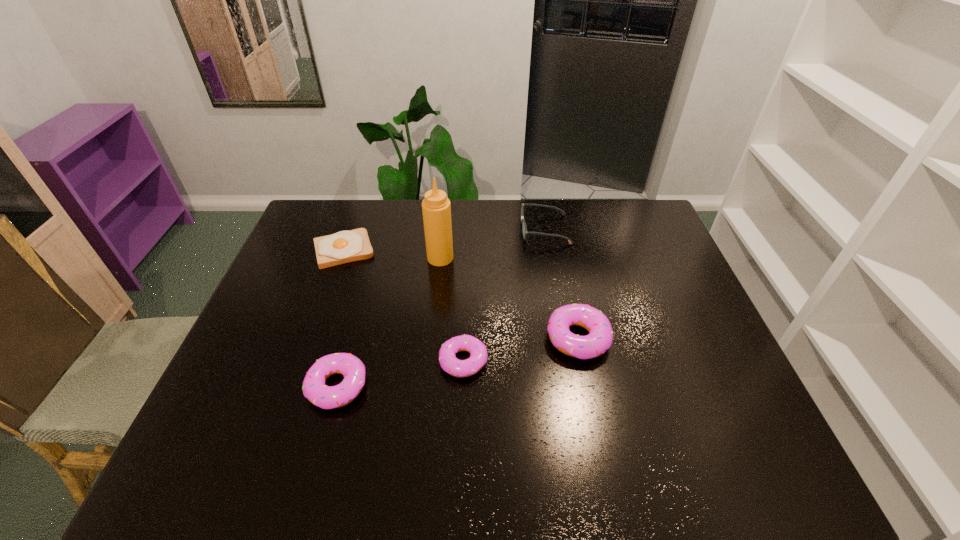
Observe the arrangement of all doughnuts in the image. To keep them evenly spaced, where would you place another doughnut on the right? Please locate a free space. Please provide its 2D coordinates. Your answer should be formatted as a tuple, i.e. [(x, y)], where the tuple contains the x and y coordinates of a point satisfying the conditions above.

[(683, 317)]